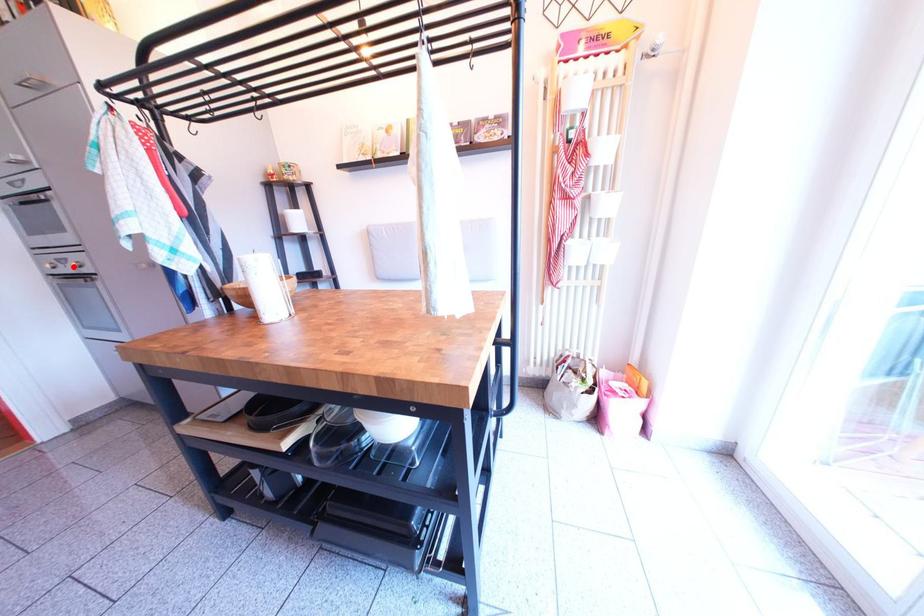
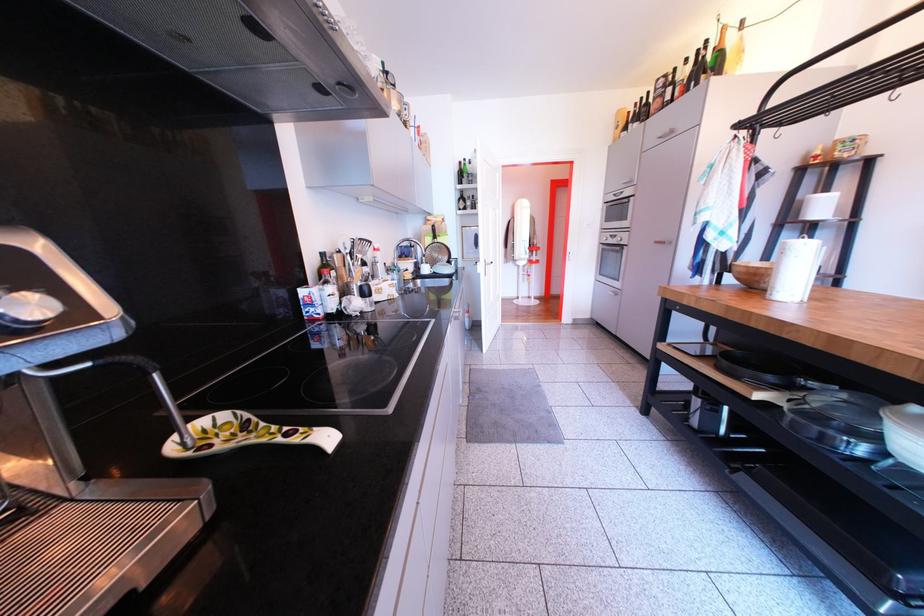
In the second image, find the point that corresponds to the highlighted location in the first image.

(624, 243)